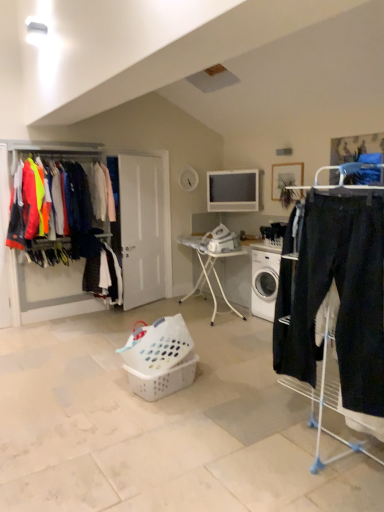
Where is `free space in front of white plastic basket at center, positioned as the first basket in bottom-to-top order`? The height and width of the screenshot is (512, 384). free space in front of white plastic basket at center, positioned as the first basket in bottom-to-top order is located at coordinates (172, 414).